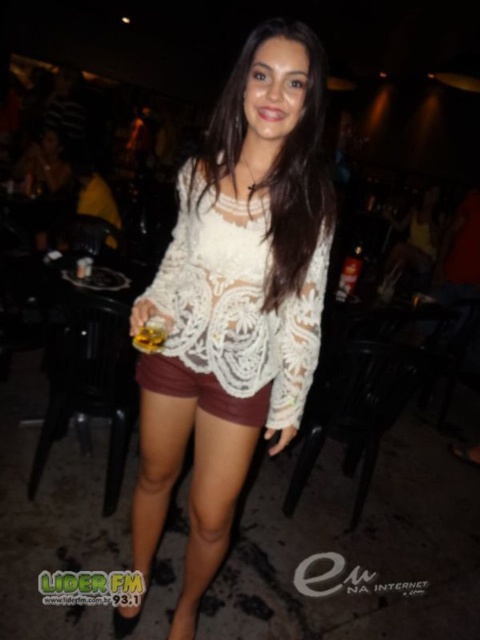
Question: Observing the image, what is the correct spatial positioning of white lace top at center in reference to white lace blouse at center?

Choices:
 (A) below
 (B) above

Answer: (A)

Question: Estimate the real-world distances between objects in this image. Which object is closer to the white lace top at center?

Choices:
 (A) gold metallic cup at center
 (B) white lace dress at center
 (C) matte lace shorts at center

Answer: (B)

Question: Which point appears closest to the camera in this image?

Choices:
 (A) (228, 180)
 (B) (135, 374)
 (C) (159, 275)

Answer: (A)

Question: Does white lace top at center have a smaller size compared to white lace blouse at center?

Choices:
 (A) yes
 (B) no

Answer: (B)

Question: Which point appears closest to the camera in this image?

Choices:
 (A) (298, 38)
 (B) (188, 552)
 (C) (202, 276)

Answer: (A)

Question: Is white lace top at center positioned in front of white lace dress at center?

Choices:
 (A) no
 (B) yes

Answer: (B)